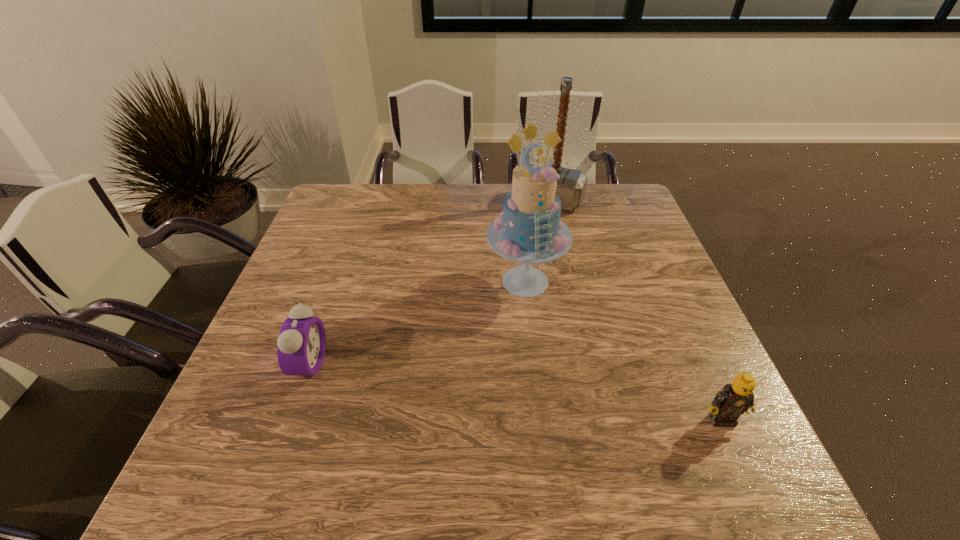
Locate an element on the screen. vacant region between the Lego and the alarm clock is located at coordinates (516, 392).

Locate an element on the screen. free space between the alarm clock and the third nearest object is located at coordinates (418, 322).

Where is `vacant point located between the second farthest object and the Lego`? vacant point located between the second farthest object and the Lego is located at coordinates (623, 350).

Locate an element on the screen. This screenshot has height=540, width=960. empty space between the cake and the leftmost object is located at coordinates (418, 322).

This screenshot has height=540, width=960. I want to click on the closest object to the farthest object, so click(529, 230).

At what (x,y) coordinates should I click in order to perform the action: click on object identified as the third closest to the alarm clock. Please return your answer as a coordinate pair (x, y). The width and height of the screenshot is (960, 540). Looking at the image, I should click on (734, 399).